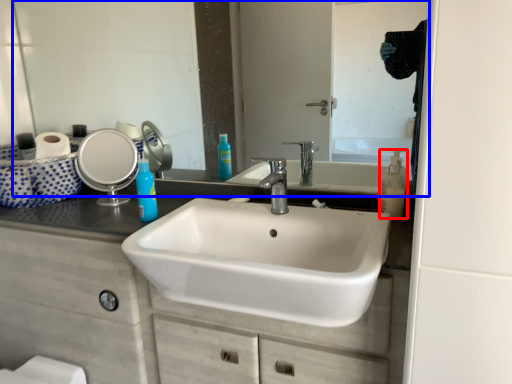
Question: Which object appears farthest to the camera in this image, soap dispenser (highlighted by a red box) or mirror (highlighted by a blue box)?

Choices:
 (A) soap dispenser
 (B) mirror

Answer: (A)